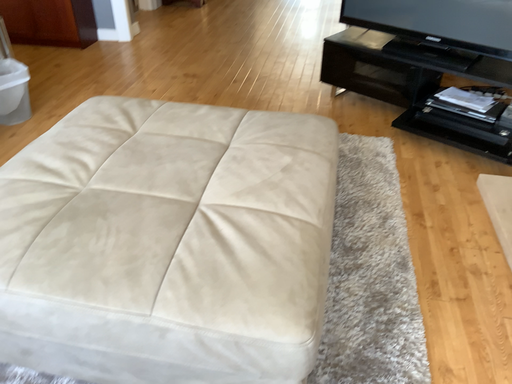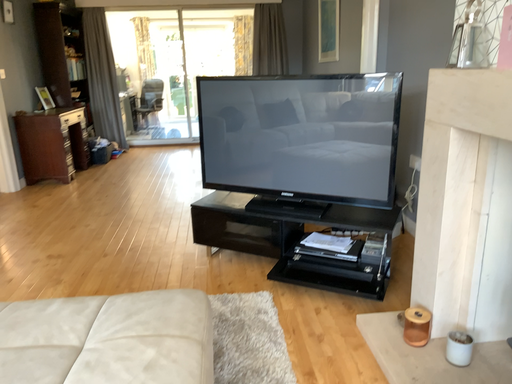
Question: How did the camera likely rotate when shooting the video?

Choices:
 (A) rotated upward
 (B) rotated downward

Answer: (A)